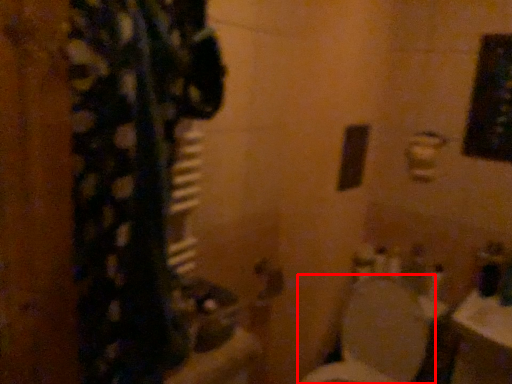
Question: From the image, what is the correct spatial relationship of toilet (annotated by the red box) in relation to door handle?

Choices:
 (A) left
 (B) right

Answer: (B)